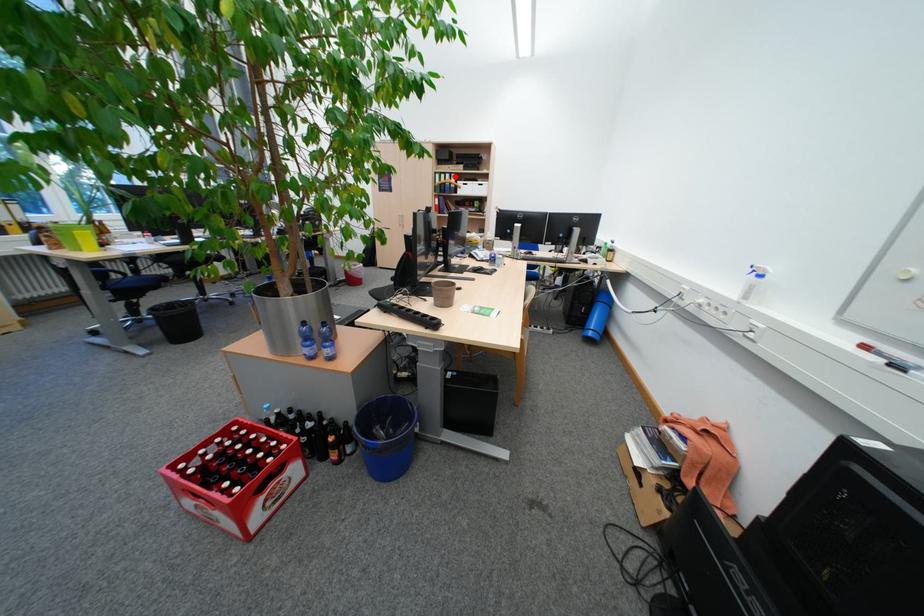
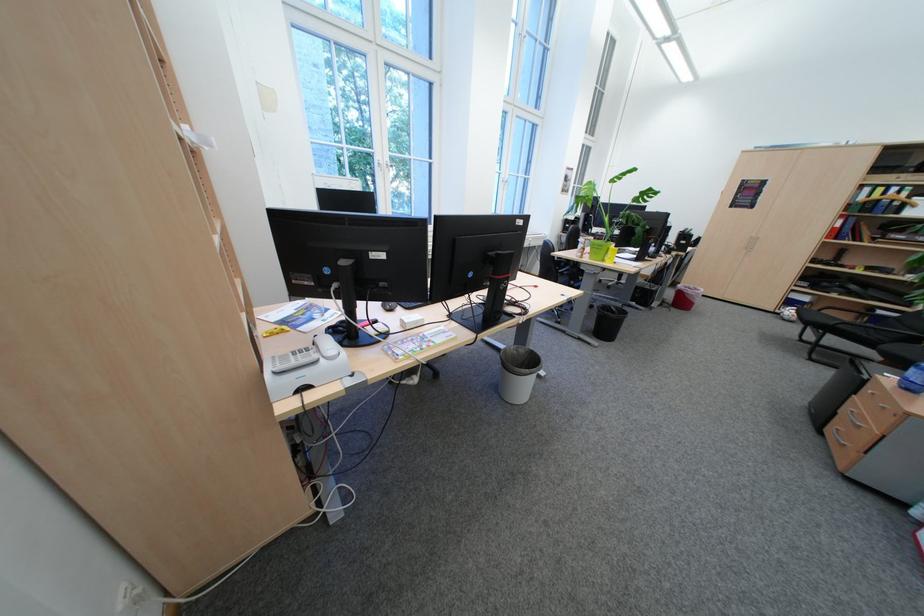
Question: I am providing you with two images of the same scene from different viewpoints. A red point is shown in image1. For the corresponding object point in image2, is it positioned nearer or farther from the camera?

Choices:
 (A) Nearer
 (B) Farther

Answer: (B)